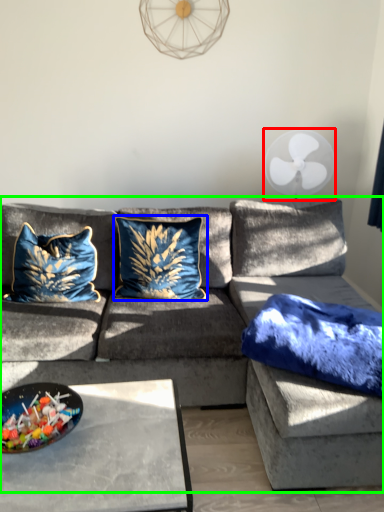
Question: Which object is positioned farthest from mechanical fan (highlighted by a red box)? Select from pillow (highlighted by a blue box) and studio couch (highlighted by a green box).

Choices:
 (A) pillow
 (B) studio couch

Answer: (A)